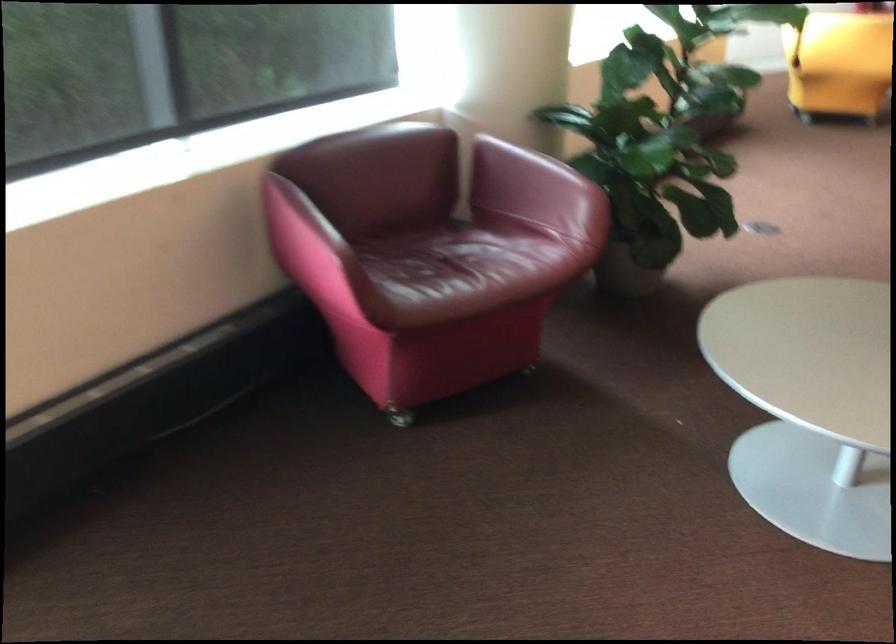
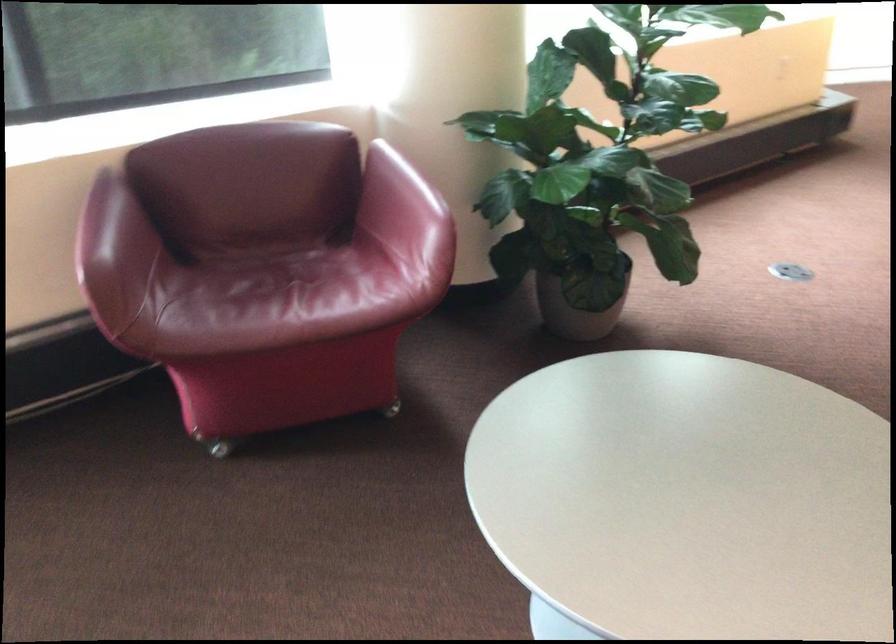
The images are taken continuously from a first-person perspective. In which direction are you moving?

The cameraman moved toward right, forward.